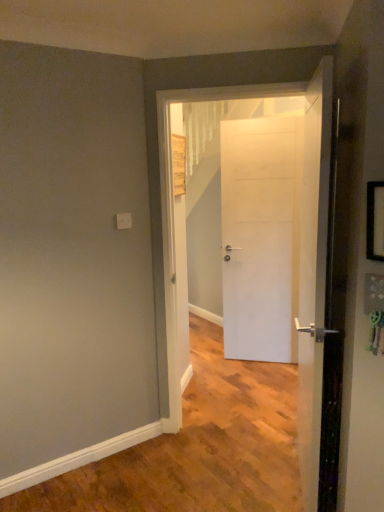
Question: Considering the positions of point (304, 495) and point (379, 209), is point (304, 495) closer or farther from the camera than point (379, 209)?

Choices:
 (A) closer
 (B) farther

Answer: (B)

Question: From the image's perspective, is white matte door at center, positioned as the 3th door in back-to-front order, above or below black plastic picture frame at right?

Choices:
 (A) below
 (B) above

Answer: (A)

Question: Based on their relative distances, which object is farther from the black plastic picture frame at right?

Choices:
 (A) white matte door at center, positioned as the 1th door in back-to-front order
 (B) white matte door at center, positioned as the 3th door in back-to-front order
 (C) white matte door at center, arranged as the 2th door when viewed from the front

Answer: (A)

Question: Which object is the farthest from the white matte door at center, positioned as the 1th door in back-to-front order?

Choices:
 (A) black plastic picture frame at right
 (B) white matte door at center, arranged as the 2th door when viewed from the front
 (C) white matte door at center, which appears as the first door when viewed from the front

Answer: (A)